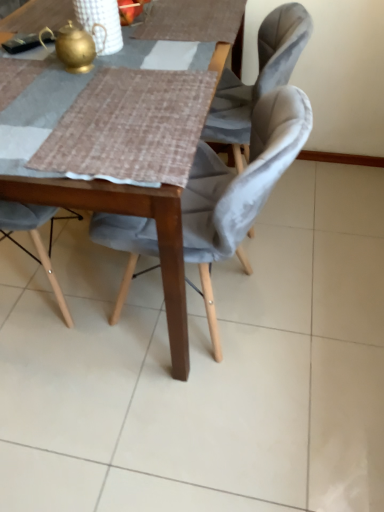
Question: Is point (220, 172) closer or farther from the camera than point (48, 192)?

Choices:
 (A) farther
 (B) closer

Answer: (A)

Question: In terms of width, does velvet grey chair at center look wider or thinner when compared to wooden table at center?

Choices:
 (A) thin
 (B) wide

Answer: (A)

Question: Based on their relative distances, which object is farther from the wooden table at center?

Choices:
 (A) gold metallic teapot at upper left
 (B) velvet grey chair at center

Answer: (A)

Question: Estimate the real-world distances between objects in this image. Which object is closer to the velvet grey chair at center?

Choices:
 (A) wooden table at center
 (B) gold metallic teapot at upper left

Answer: (A)